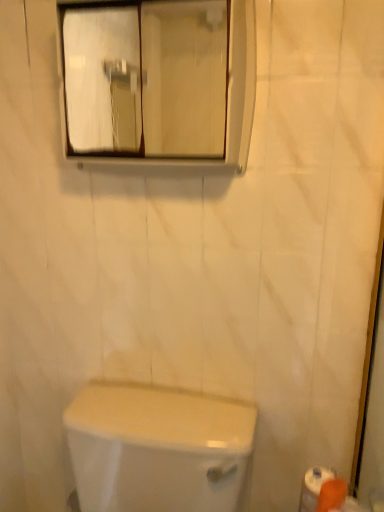
Question: Is point (114, 141) closer or farther from the camera than point (238, 488)?

Choices:
 (A) closer
 (B) farther

Answer: (B)

Question: Considering the positions of clear glass mirror at upper center and white glossy toilet at lower center in the image, is clear glass mirror at upper center bigger or smaller than white glossy toilet at lower center?

Choices:
 (A) small
 (B) big

Answer: (A)

Question: Which object is positioned farthest from the white glossy toilet at lower center?

Choices:
 (A) orange matte toilet paper at lower right
 (B) clear glass mirror at upper center

Answer: (B)

Question: Based on their relative distances, which object is nearer to the white glossy toilet at lower center?

Choices:
 (A) orange matte toilet paper at lower right
 (B) clear glass mirror at upper center

Answer: (A)